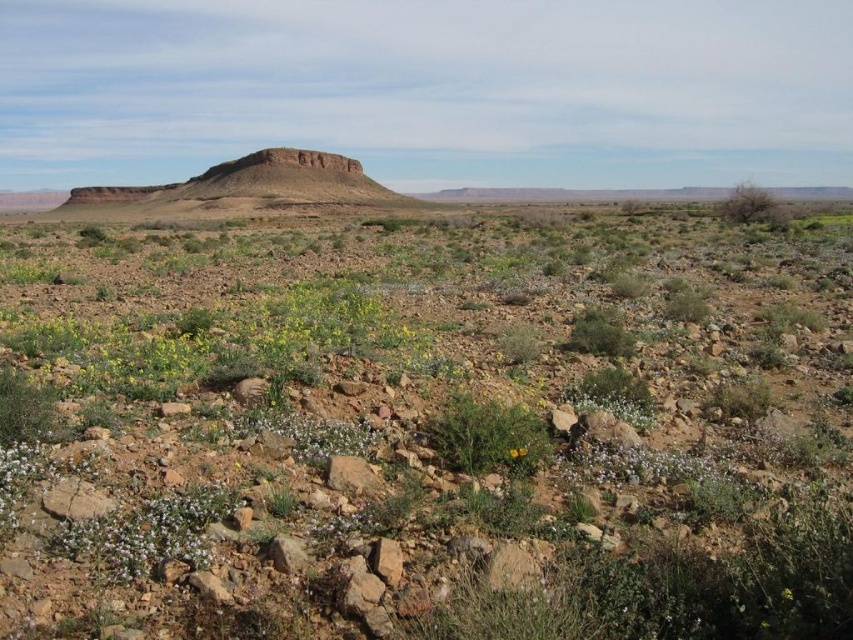
Image resolution: width=853 pixels, height=640 pixels. Identify the location of rustic rock formation at center. tap(250, 188).

Does rustic rock formation at center appear over green leafy plant at center?

Indeed, rustic rock formation at center is positioned over green leafy plant at center.

Who is more distant from viewer, (293, 156) or (440, 440)?

Positioned behind is point (293, 156).

This screenshot has width=853, height=640. Find the location of `rustic rock formation at center`. rustic rock formation at center is located at coordinates (250, 188).

From the picture: Can you confirm if brown rocky hill at upper center is thinner than green leafy plant at center?

No.

Is brown rocky hill at upper center to the right of green leafy plant at center from the viewer's perspective?

No, brown rocky hill at upper center is not to the right of green leafy plant at center.

What are the coordinates of `brown rocky hill at upper center` in the screenshot? It's located at (424, 428).

Does brown rocky hill at upper center lie behind rustic rock formation at center?

No.

Describe the element at coordinates (424, 428) in the screenshot. Image resolution: width=853 pixels, height=640 pixels. I see `brown rocky hill at upper center` at that location.

Does point (628, 408) come in front of point (222, 209)?

Yes, point (628, 408) is closer to viewer.

Identify the location of brown rocky hill at upper center. (424, 428).